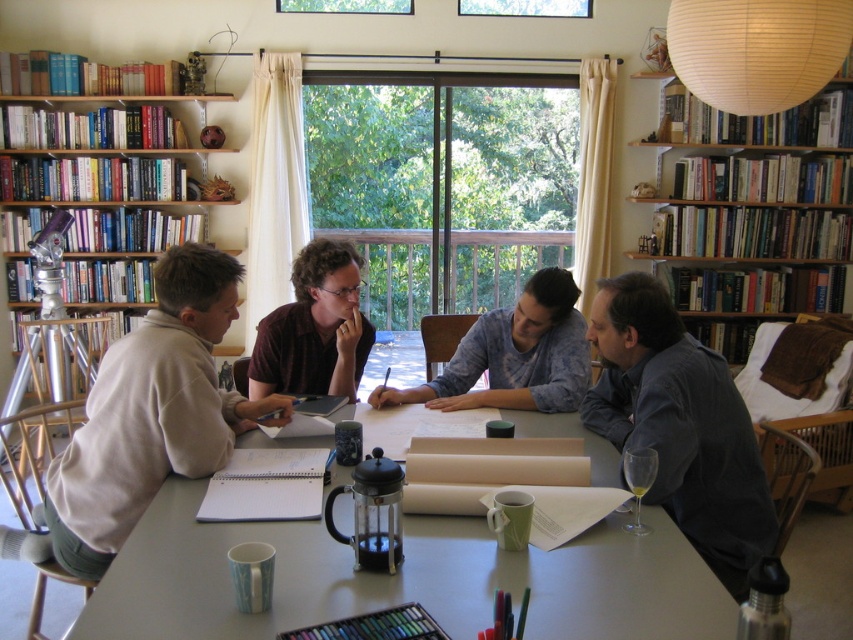
Question: Among these objects, which one is farthest from the camera?

Choices:
 (A) dark blue shirt at lower right
 (B) wooden bookshelf at upper right

Answer: (B)

Question: Which of the following is the farthest from the observer?

Choices:
 (A) (326, 317)
 (B) (67, 547)
 (C) (564, 339)

Answer: (C)

Question: Is the position of white matte table at center less distant than that of wooden bookshelf at upper right?

Choices:
 (A) yes
 (B) no

Answer: (A)

Question: Which object is farther from the camera taking this photo?

Choices:
 (A) light beige sweater at left
 (B) white matte table at center
 (C) matte brown shirt at center

Answer: (C)

Question: From the image, what is the correct spatial relationship of wooden bookshelf at upper right in relation to light blue cotton shirt at center?

Choices:
 (A) right
 (B) left

Answer: (A)

Question: Does white matte table at center have a larger size compared to wooden bookshelf at upper right?

Choices:
 (A) no
 (B) yes

Answer: (A)